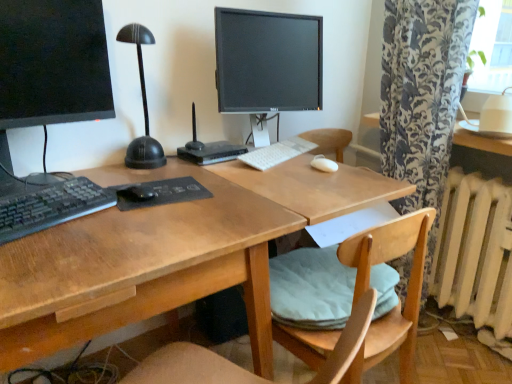
At what (x,y) coordinates should I click in order to perform the action: click on free space in front of white matte mouse at center. Please return your answer as a coordinate pair (x, y). Image resolution: width=512 pixels, height=384 pixels. Looking at the image, I should click on (315, 179).